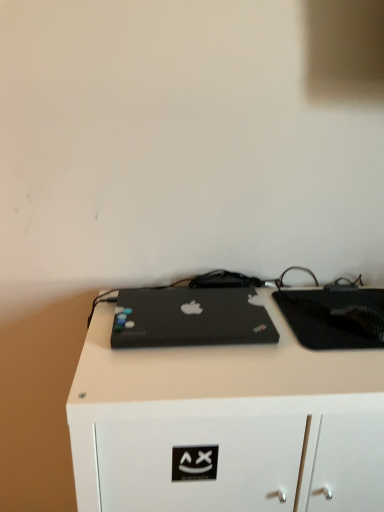
Where is `empty space that is ontop of black matte desk at center (from a real-world perspective)`? empty space that is ontop of black matte desk at center (from a real-world perspective) is located at coordinates (283, 334).